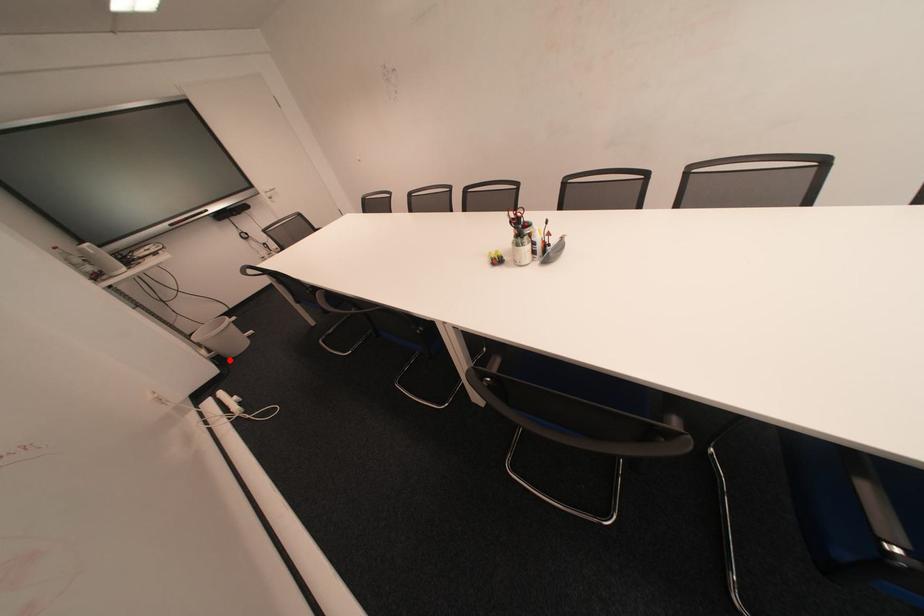
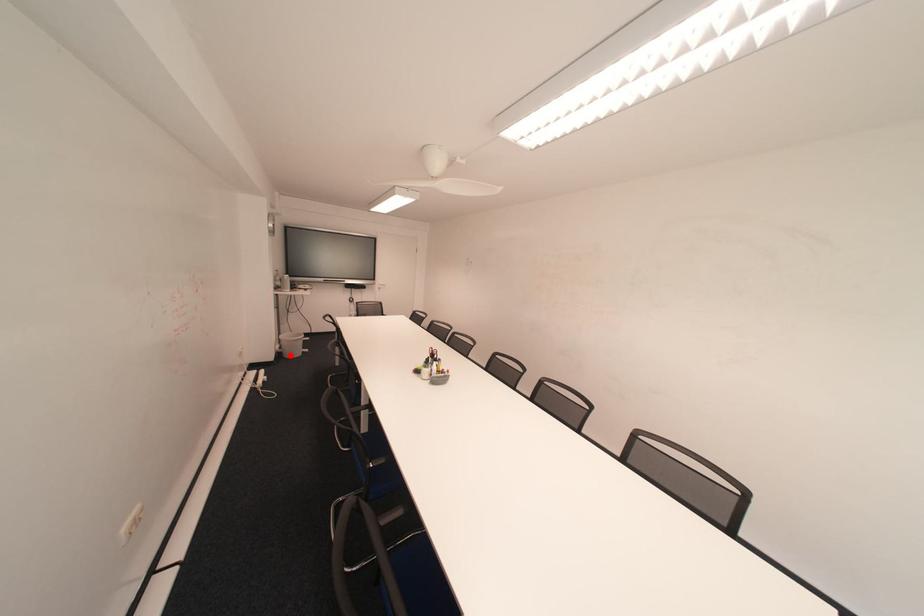
I am providing you with two images of the same scene from different viewpoints. A red point is marked on the first image and another point is marked on the second image. Are the points marked in image1 and image2 representing the same 3D position?

Yes